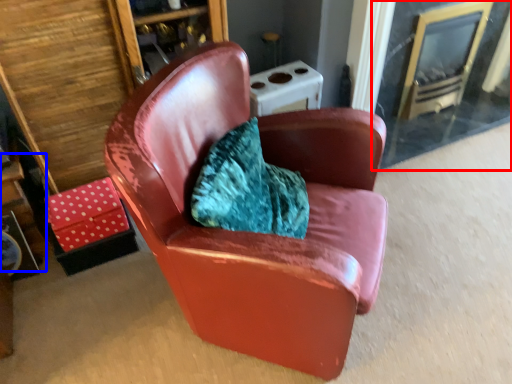
Question: Which object appears closest to the camera in this image, glass door (highlighted by a red box) or table (highlighted by a blue box)?

Choices:
 (A) glass door
 (B) table

Answer: (B)